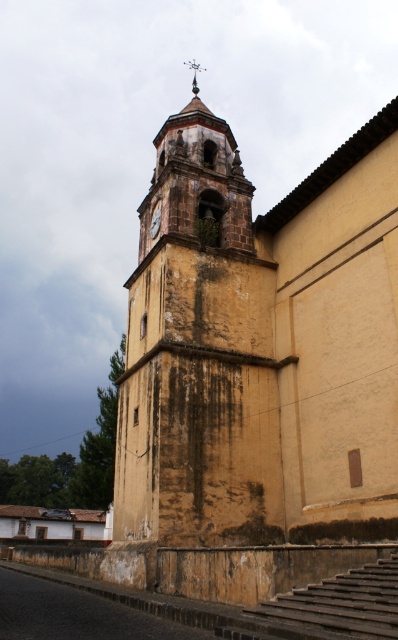
Question: Which of the following is the farthest from the observer?

Choices:
 (A) brown stone stairs at lower right
 (B) brown wooden clock at center
 (C) yellowish stucco tower at center

Answer: (B)

Question: Which object is the farthest from the yellowish stucco tower at center?

Choices:
 (A) brown stone stairs at lower right
 (B) brown wooden clock at center

Answer: (A)

Question: Is yellowish stucco tower at center to the left of brown stone stairs at lower right from the viewer's perspective?

Choices:
 (A) no
 (B) yes

Answer: (B)

Question: Can you confirm if brown stone stairs at lower right is positioned to the right of brown wooden clock at center?

Choices:
 (A) no
 (B) yes

Answer: (B)

Question: Which object is positioned closest to the yellowish stucco tower at center?

Choices:
 (A) brown stone stairs at lower right
 (B) brown wooden clock at center

Answer: (B)

Question: Is yellowish stucco tower at center below brown stone stairs at lower right?

Choices:
 (A) no
 (B) yes

Answer: (A)